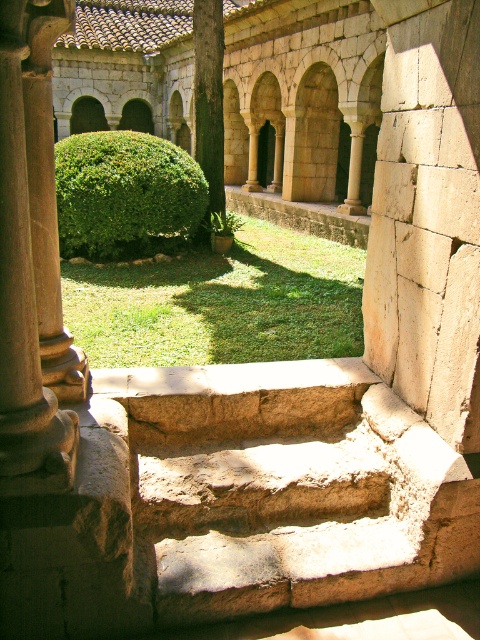
You are standing at the bottom of the natural stone steps at center and want to reach the smooth stone column at left. Which direction should you move to get there?

To reach the smooth stone column at left from the natural stone steps at center, you should move upward since the natural stone steps at center is located below the smooth stone column at left.

You are an architect designing a new courtyard. You want to place a statue between the smooth stone column at left and the green textured pillar at center. Which column should the statue be closer to if it needs to be placed on the narrower side of the two?

The smooth stone column at left is thinner than the green textured pillar at center, so the statue should be placed closer to the smooth stone column at left to align with the narrower side.